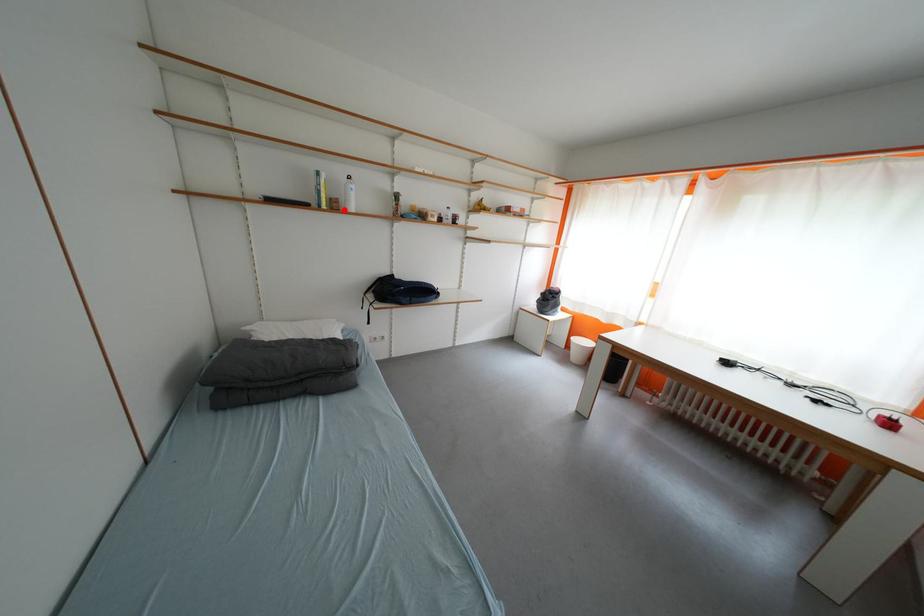
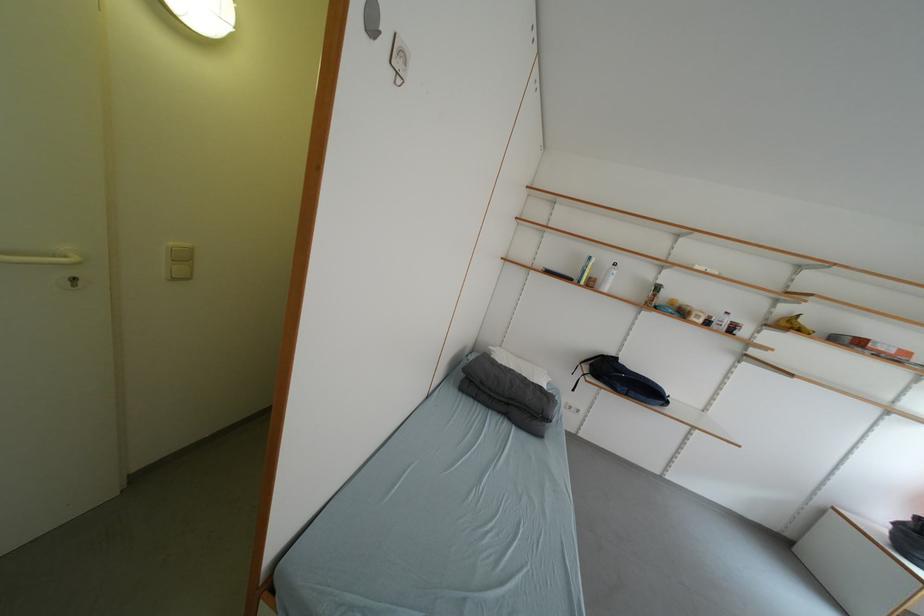
Find the pixel in the second image that matches the highlighted location in the first image.

(600, 286)